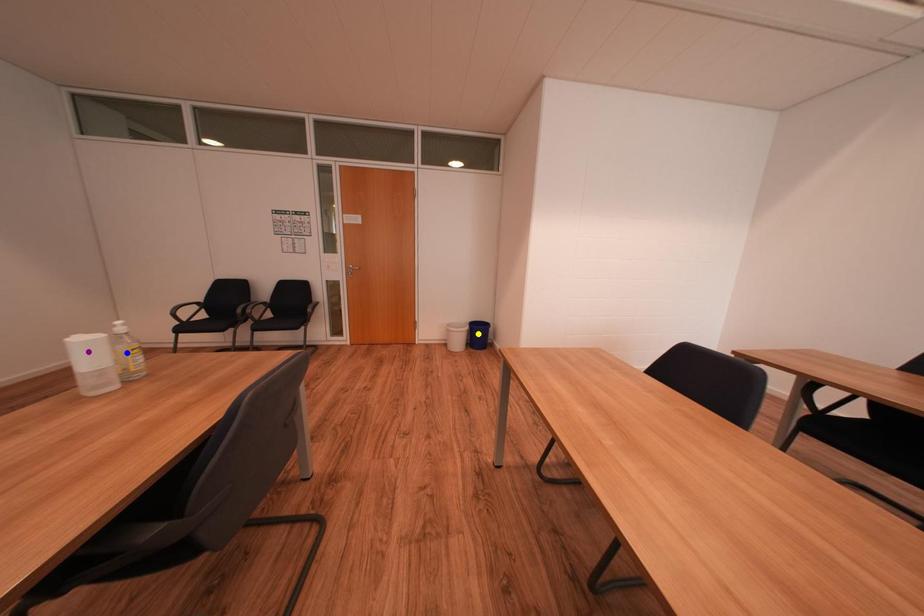
Order these from nearest to farthest:
A) blue point
B) yellow point
C) purple point

blue point, purple point, yellow point